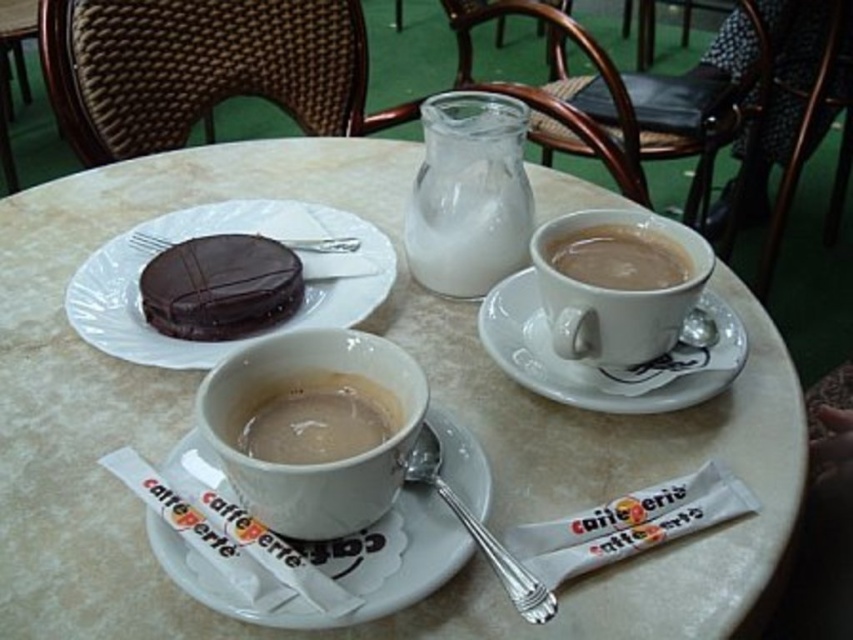
Does point (151, 602) come closer to viewer compared to point (141, 324)?

Yes, it is.

Locate an element on the screen. The height and width of the screenshot is (640, 853). white ceramic table at center is located at coordinates (432, 400).

Image resolution: width=853 pixels, height=640 pixels. What are the coordinates of `white ceramic table at center` in the screenshot? It's located at (432, 400).

Is white ceramic saucer at upper right wider than chocolatesmoothcake at left?

Correct, the width of white ceramic saucer at upper right exceeds that of chocolatesmoothcake at left.

Is point (515, 348) positioned in front of point (194, 273)?

Yes, point (515, 348) is in front of point (194, 273).

I want to click on white ceramic saucer at upper right, so click(x=606, y=369).

From the picture: Can you confirm if white ceramic table at center is bigger than matte white cup at center?

Yes, white ceramic table at center is bigger than matte white cup at center.

How distant is white ceramic table at center from matte white cup at center?

white ceramic table at center and matte white cup at center are 9.51 inches apart.

Between point (107, 211) and point (296, 433), which one is positioned behind?

Positioned behind is point (107, 211).

At what (x,y) coordinates should I click in order to perform the action: click on white ceramic table at center. Please return your answer as a coordinate pair (x, y). The width and height of the screenshot is (853, 640). Looking at the image, I should click on (432, 400).